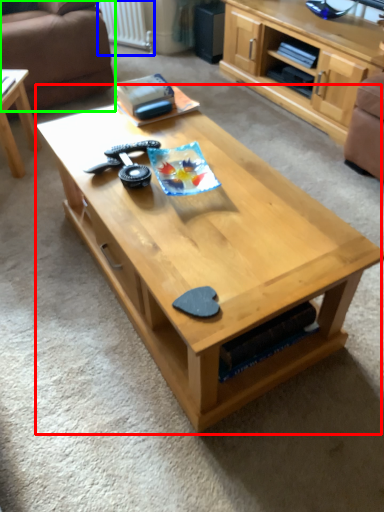
Question: Which is nearer to the coffee table (highlighted by a red box)? radiator (highlighted by a blue box) or studio couch (highlighted by a green box).

Choices:
 (A) radiator
 (B) studio couch

Answer: (B)